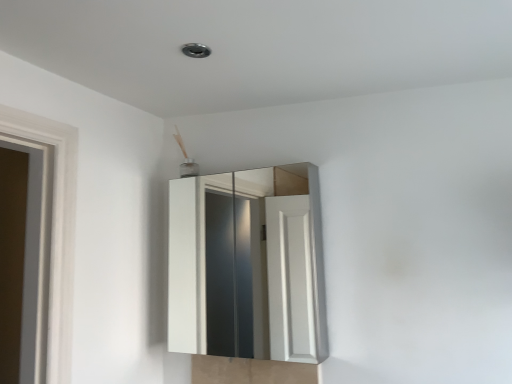
What is the approximate height of white glossy medicine cabinet at center?

The height of white glossy medicine cabinet at center is 31.93 inches.

Describe the element at coordinates (247, 265) in the screenshot. The image size is (512, 384). I see `white glossy medicine cabinet at center` at that location.

At what (x,y) coordinates should I click in order to perform the action: click on white glossy medicine cabinet at center. Please return your answer as a coordinate pair (x, y). The width and height of the screenshot is (512, 384). Looking at the image, I should click on (247, 265).

What are the coordinates of `white glossy medicine cabinet at center` in the screenshot? It's located at (247, 265).